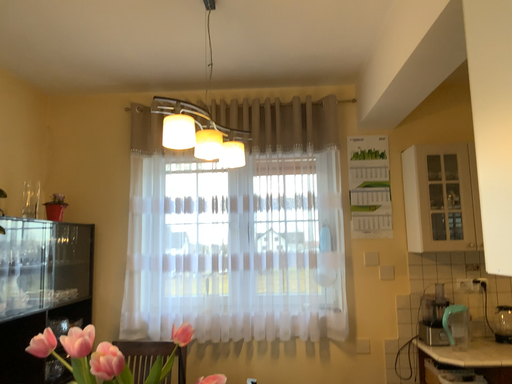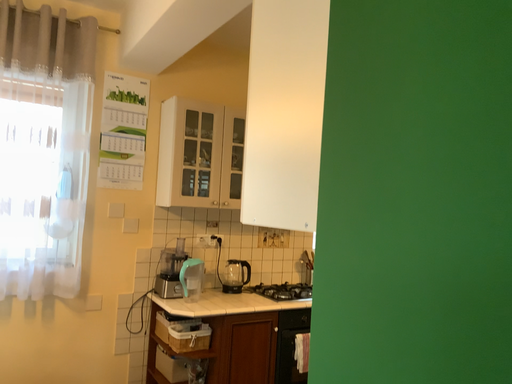
Question: Which way did the camera rotate in the video?

Choices:
 (A) rotated upward
 (B) rotated downward

Answer: (B)